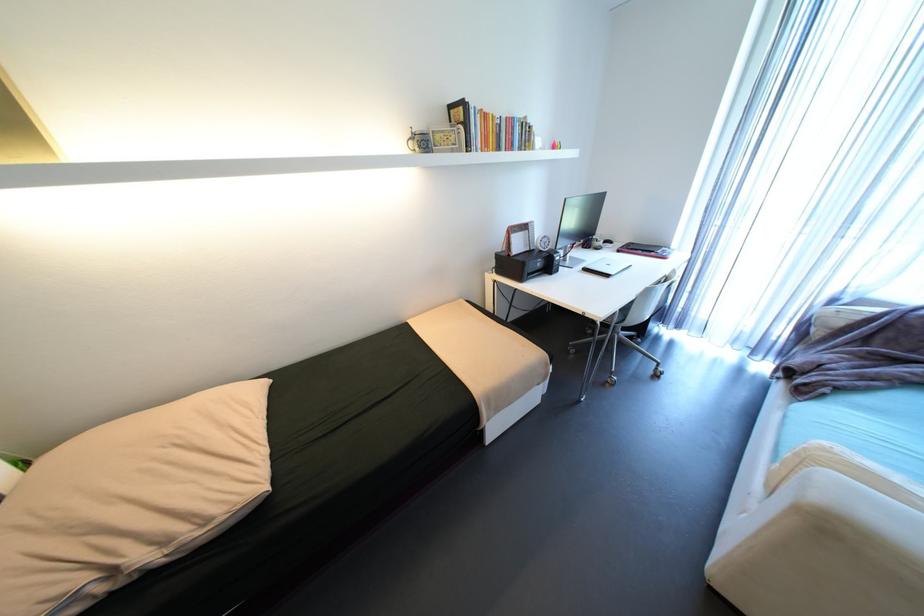
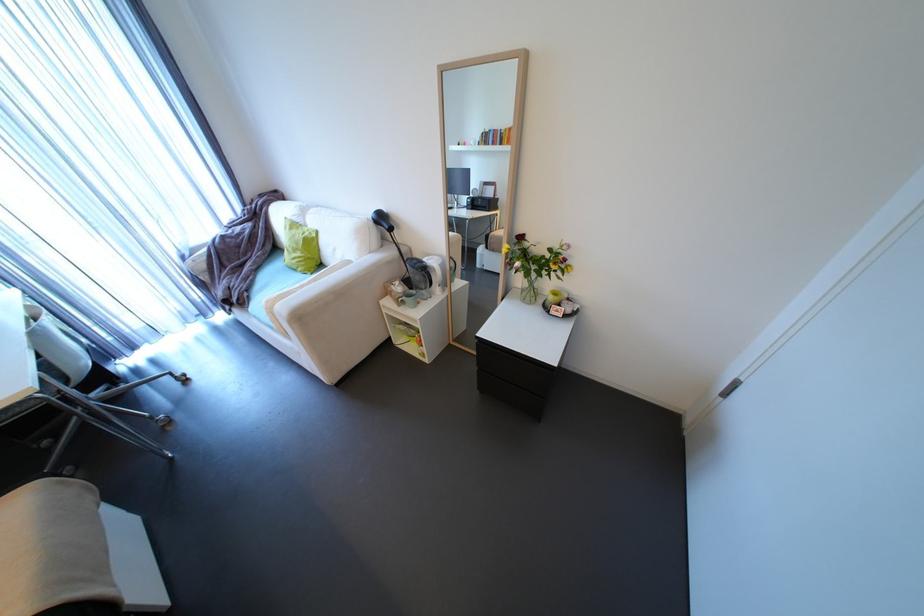
Where in the second image is the point corresponding to point (852, 302) from the first image?

(195, 254)